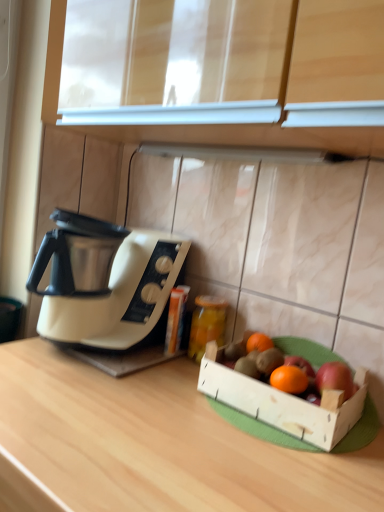
Locate an element on the screen. The width and height of the screenshot is (384, 512). free spot above wooden at center (from a real-world perspective) is located at coordinates (150, 419).